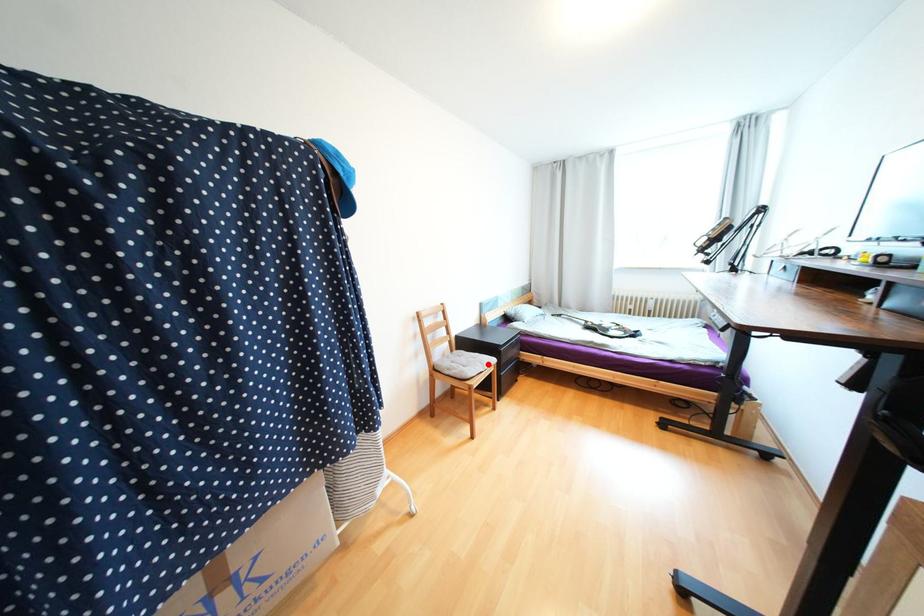
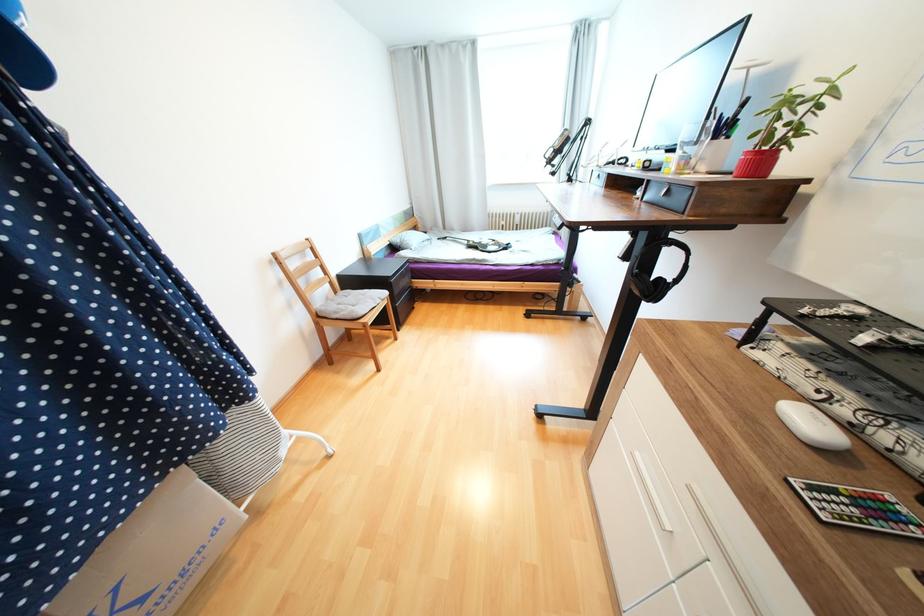
Find the pixel in the second image that matches the highlighted location in the first image.

(379, 300)